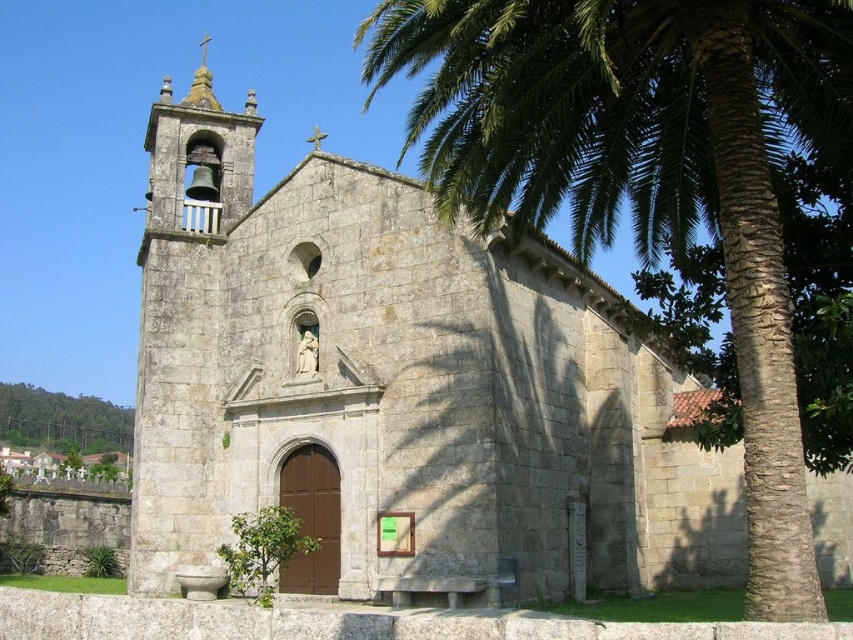
Is green leafy palm tree at center smaller than green leafy tree at upper left?

→ Actually, green leafy palm tree at center might be larger than green leafy tree at upper left.

Is green leafy palm tree at center further to the viewer compared to green leafy tree at upper left?

That is False.

This screenshot has height=640, width=853. What do you see at coordinates (647, 172) in the screenshot?
I see `green leafy palm tree at center` at bounding box center [647, 172].

What are the coordinates of `green leafy palm tree at center` in the screenshot? It's located at (647, 172).